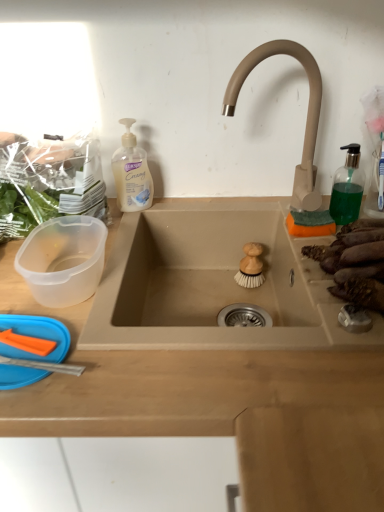
Question: Considering the relative sizes of beige matte faucet at upper right and green translucent soap dispenser at right in the image provided, is beige matte faucet at upper right taller than green translucent soap dispenser at right?

Choices:
 (A) no
 (B) yes

Answer: (B)

Question: Does beige matte faucet at upper right have a smaller size compared to green translucent soap dispenser at right?

Choices:
 (A) no
 (B) yes

Answer: (A)

Question: Is beige matte faucet at upper right at the right side of green translucent soap dispenser at right?

Choices:
 (A) no
 (B) yes

Answer: (A)

Question: Is beige matte faucet at upper right to the left of green translucent soap dispenser at right from the viewer's perspective?

Choices:
 (A) yes
 (B) no

Answer: (A)

Question: From a real-world perspective, is beige matte faucet at upper right over green translucent soap dispenser at right?

Choices:
 (A) no
 (B) yes

Answer: (B)

Question: Does beige matte faucet at upper right turn towards green translucent soap dispenser at right?

Choices:
 (A) yes
 (B) no

Answer: (B)

Question: Is beige matte faucet at upper right located outside brown matte sweet potatoes at right, acting as the first food starting from the right?

Choices:
 (A) no
 (B) yes

Answer: (B)

Question: From a real-world perspective, is beige matte faucet at upper right below brown matte sweet potatoes at right, which is the third food from left to right?

Choices:
 (A) yes
 (B) no

Answer: (B)

Question: Is brown matte sweet potatoes at right, which is the third food from left to right, at the back of beige matte faucet at upper right?

Choices:
 (A) no
 (B) yes

Answer: (A)

Question: Considering the relative sizes of beige matte faucet at upper right and brown matte sweet potatoes at right, acting as the first food starting from the right, in the image provided, is beige matte faucet at upper right wider than brown matte sweet potatoes at right, acting as the first food starting from the right,?

Choices:
 (A) no
 (B) yes

Answer: (A)

Question: Is beige matte faucet at upper right further to the viewer compared to brown matte sweet potatoes at right, acting as the first food starting from the right?

Choices:
 (A) yes
 (B) no

Answer: (A)

Question: Is beige matte faucet at upper right at the left side of brown matte sweet potatoes at right, which is the third food from left to right?

Choices:
 (A) yes
 (B) no

Answer: (A)

Question: Considering the relative sizes of beige matte faucet at upper right and wooden brush at sink center, which is the 2th food from right to left, in the image provided, is beige matte faucet at upper right smaller than wooden brush at sink center, which is the 2th food from right to left,?

Choices:
 (A) yes
 (B) no

Answer: (B)